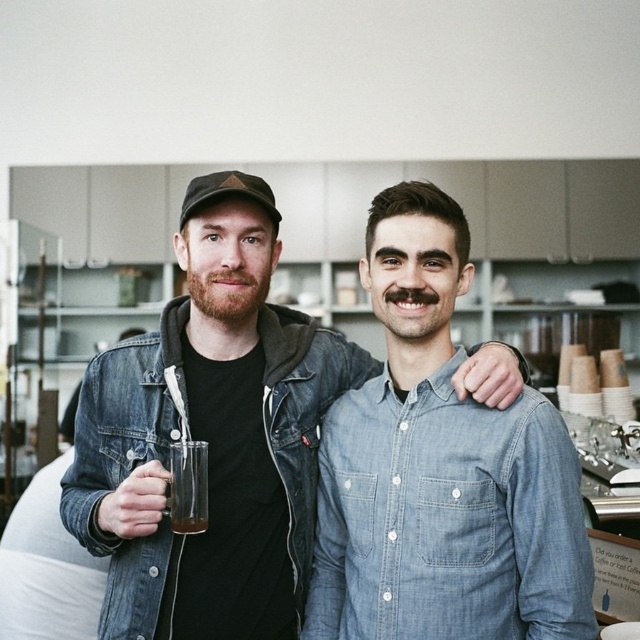
Question: Which of the following is the farthest from the observer?

Choices:
 (A) (260, 280)
 (B) (180, 529)
 (C) (179, 490)
 (D) (483, 428)

Answer: (A)

Question: Can you confirm if denim shirt at center is wider than translucent glass at lower left?

Choices:
 (A) yes
 (B) no

Answer: (A)

Question: Which of the following is the closest to the observer?

Choices:
 (A) (177, 472)
 (B) (186, 531)
 (C) (125, 529)

Answer: (C)

Question: Is translucent glass mug at center bigger than translucent glass at lower left?

Choices:
 (A) yes
 (B) no

Answer: (A)

Question: Does denim shirt at center appear over translucent glass at lower left?

Choices:
 (A) yes
 (B) no

Answer: (A)

Question: Which point appears closest to the camera in this image?

Choices:
 (A) (257, 584)
 (B) (180, 483)

Answer: (B)